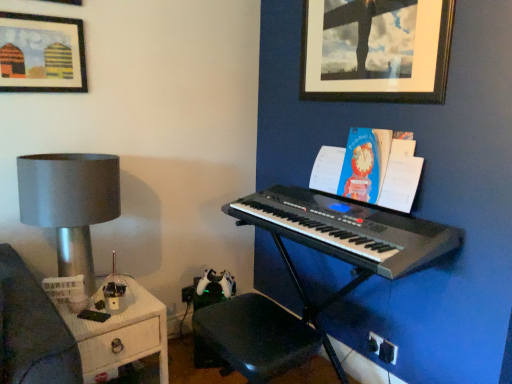
Question: Would you consider white wood side table at lower left to be distant from black plastic keyboard at center?

Choices:
 (A) no
 (B) yes

Answer: (A)

Question: From the image's perspective, is white wood side table at lower left above black plastic keyboard at center?

Choices:
 (A) no
 (B) yes

Answer: (A)

Question: Is white wood side table at lower left behind black plastic keyboard at center?

Choices:
 (A) yes
 (B) no

Answer: (A)

Question: Can you confirm if white wood side table at lower left is wider than black plastic keyboard at center?

Choices:
 (A) no
 (B) yes

Answer: (B)

Question: From a real-world perspective, is white wood side table at lower left over black plastic keyboard at center?

Choices:
 (A) yes
 (B) no

Answer: (B)

Question: Is white wood side table at lower left oriented away from black plastic keyboard at center?

Choices:
 (A) no
 (B) yes

Answer: (A)

Question: Considering the relative positions of white wood side table at lower left and black plastic keyboard at center in the image provided, is white wood side table at lower left behind black plastic keyboard at center?

Choices:
 (A) no
 (B) yes

Answer: (B)

Question: Does white wood side table at lower left have a greater height compared to black plastic keyboard at center?

Choices:
 (A) no
 (B) yes

Answer: (B)

Question: Is white wood side table at lower left turned away from black plastic keyboard at center?

Choices:
 (A) yes
 (B) no

Answer: (B)

Question: Considering the relative sizes of white wood side table at lower left and black plastic keyboard at center in the image provided, is white wood side table at lower left shorter than black plastic keyboard at center?

Choices:
 (A) yes
 (B) no

Answer: (B)

Question: Can we say white wood side table at lower left lies outside black plastic keyboard at center?

Choices:
 (A) no
 (B) yes

Answer: (B)

Question: From the image's perspective, does white wood side table at lower left appear lower than black plastic keyboard at center?

Choices:
 (A) yes
 (B) no

Answer: (A)

Question: Is the depth of matte silver lamp at left greater than that of blue paper book at upper right?

Choices:
 (A) no
 (B) yes

Answer: (A)